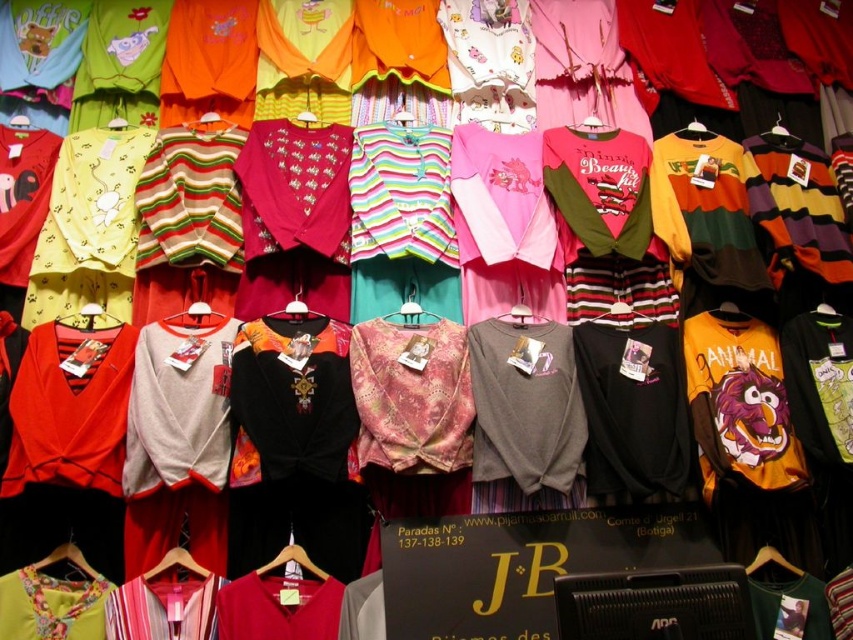
Does black matte t-shirt at center have a larger size compared to matte red sweater at left?

Indeed, black matte t-shirt at center has a larger size compared to matte red sweater at left.

Does black matte t-shirt at center lie behind matte red sweater at left?

Yes.

The height and width of the screenshot is (640, 853). What do you see at coordinates (634, 410) in the screenshot?
I see `black matte t-shirt at center` at bounding box center [634, 410].

The image size is (853, 640). In order to click on black matte t-shirt at center in this screenshot , I will do `click(634, 410)`.

Does matte red sweater at center have a lesser height compared to matte red shirt at lower center?

No.

Is matte red sweater at center in front of matte red shirt at lower center?

Yes, it is.

Is point (262, 616) closer to camera compared to point (309, 564)?

Yes, point (262, 616) is in front of point (309, 564).

Identify the location of matte red sweater at center. (277, 608).

Which is more to the left, matte red sweater at left or matte red sweater at center?

matte red sweater at left is more to the left.

At what (x,y) coordinates should I click in order to perform the action: click on matte red sweater at left. Please return your answer as a coordinate pair (x, y). The image size is (853, 640). Looking at the image, I should click on (68, 412).